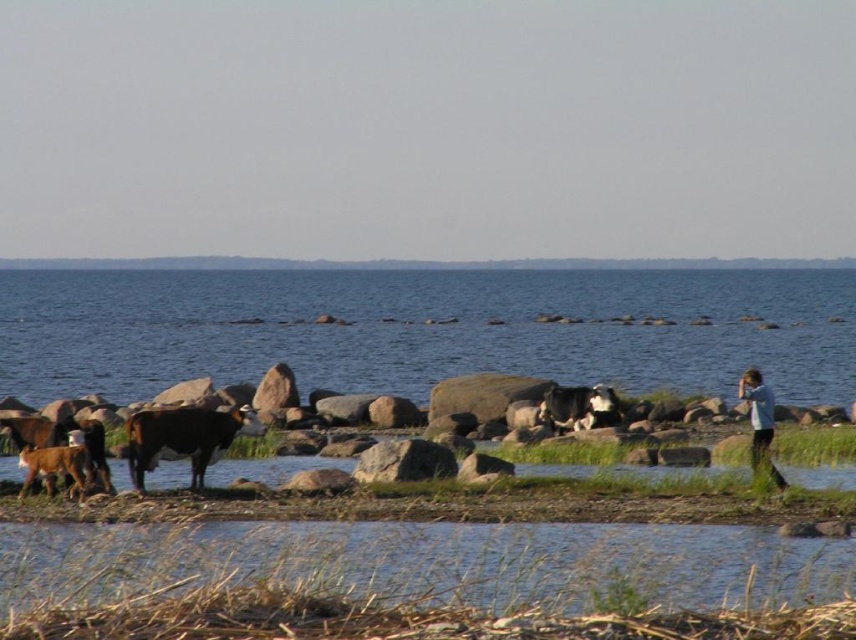
Is brown glossy cow at center to the right of blue shirt at right from the viewer's perspective?

In fact, brown glossy cow at center is to the left of blue shirt at right.

Does point (198, 456) come closer to viewer compared to point (753, 456)?

That is True.

Measure the distance between brown glossy cow at center and camera.

A distance of 24.42 meters exists between brown glossy cow at center and camera.

The height and width of the screenshot is (640, 856). In order to click on brown glossy cow at center in this screenshot , I will do `click(183, 436)`.

Between blue water at center and brown glossy cow at lower left, which one is positioned lower?

brown glossy cow at lower left is below.

Does blue water at center have a greater height compared to brown glossy cow at lower left?

Yes, blue water at center is taller than brown glossy cow at lower left.

Does point (468, 332) come in front of point (43, 461)?

No, (468, 332) is behind (43, 461).

Identify the location of blue water at center. The width and height of the screenshot is (856, 640). (424, 330).

Between blue water at center and blue shirt at right, which one appears on the right side from the viewer's perspective?

blue shirt at right

Which is above, blue water at center or blue shirt at right?

blue water at center is above.

Which is behind, point (152, 312) or point (756, 419)?

Positioned behind is point (152, 312).

At what (x,y) coordinates should I click in order to perform the action: click on blue water at center. Please return your answer as a coordinate pair (x, y). This screenshot has width=856, height=640. Looking at the image, I should click on (424, 330).